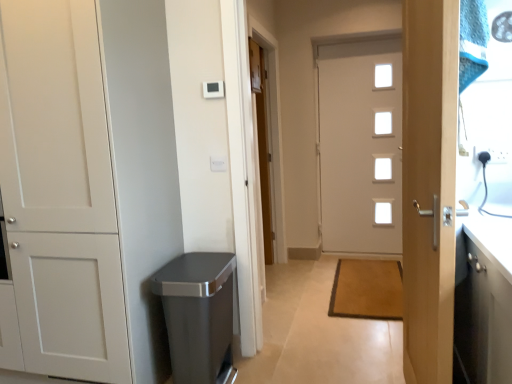
Question: From a real-world perspective, is satin silver trash can at lower left beneath white glossy door at center, marked as the fourth door in a front-to-back arrangement?

Choices:
 (A) yes
 (B) no

Answer: (A)

Question: Does satin silver trash can at lower left appear on the left side of white glossy door at center, the second door when ordered from left to right?

Choices:
 (A) yes
 (B) no

Answer: (A)

Question: From the image's perspective, is satin silver trash can at lower left on white glossy door at center, positioned as the third door in right-to-left order?

Choices:
 (A) yes
 (B) no

Answer: (B)

Question: Is satin silver trash can at lower left not within white glossy door at center, which appears as the 1th door when viewed from the back?

Choices:
 (A) no
 (B) yes

Answer: (B)

Question: Is satin silver trash can at lower left wider than white glossy door at center, marked as the fourth door in a front-to-back arrangement?

Choices:
 (A) no
 (B) yes

Answer: (B)

Question: Does satin silver trash can at lower left have a greater height compared to white glossy door at center, positioned as the third door in right-to-left order?

Choices:
 (A) no
 (B) yes

Answer: (A)

Question: From a real-world perspective, is light wood door handle at right, placed as the 4th door when sorted from back to front, physically below white matte cabinet at left, positioned as the third door in back-to-front order?

Choices:
 (A) yes
 (B) no

Answer: (A)

Question: Is light wood door handle at right, which ranks as the 1th door in front-to-back order, next to white matte cabinet at left, positioned as the first door in left-to-right order, and touching it?

Choices:
 (A) no
 (B) yes

Answer: (A)

Question: Is light wood door handle at right, placed as the 4th door when sorted from back to front, facing away from white matte cabinet at left, arranged as the second door when viewed from the front?

Choices:
 (A) no
 (B) yes

Answer: (A)

Question: Is light wood door handle at right, acting as the second door starting from the right, shorter than white matte cabinet at left, positioned as the first door in left-to-right order?

Choices:
 (A) no
 (B) yes

Answer: (B)

Question: From the image's perspective, is light wood door handle at right, the third door positioned from the left, over white matte cabinet at left, which ranks as the fourth door in right-to-left order?

Choices:
 (A) no
 (B) yes

Answer: (A)

Question: Is light wood door handle at right, placed as the 4th door when sorted from back to front, bigger than white matte cabinet at left, positioned as the first door in left-to-right order?

Choices:
 (A) yes
 (B) no

Answer: (B)

Question: Is white matte cabinet at left, arranged as the second door when viewed from the front, outside of brown textured mat at center?

Choices:
 (A) no
 (B) yes

Answer: (B)